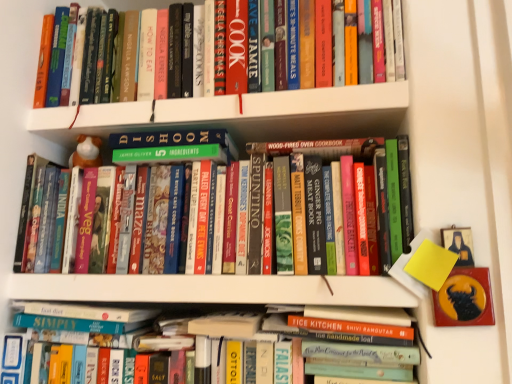
Question: Looking at their shapes, would you say hardcover books at center, the 2th book positioned from the bottom, is wider or thinner than white glossy bookshelf at upper center?

Choices:
 (A) wide
 (B) thin

Answer: (B)

Question: In terms of size, does hardcover books at center, which is the second book from top to bottom, appear bigger or smaller than white glossy bookshelf at upper center?

Choices:
 (A) small
 (B) big

Answer: (B)

Question: Which object is the closest to the hardcover book at lower center, positioned as the third book in top-to-bottom order?

Choices:
 (A) white glossy bookshelf at upper center
 (B) hardcover books at upper center, the first book in the top-to-bottom sequence
 (C) hardcover books at center, which is the second book from top to bottom

Answer: (C)

Question: Which is farther from the hardcover books at upper center, the first book in the top-to-bottom sequence?

Choices:
 (A) white glossy bookshelf at upper center
 (B) hardcover books at center, which is the second book from top to bottom
 (C) hardcover book at lower center, positioned as the third book in top-to-bottom order

Answer: (C)